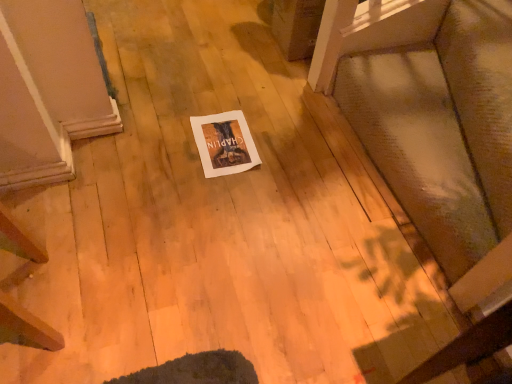
Identify the location of free space above white paper at center (from a real-world perspective). Image resolution: width=512 pixels, height=384 pixels. (226, 138).